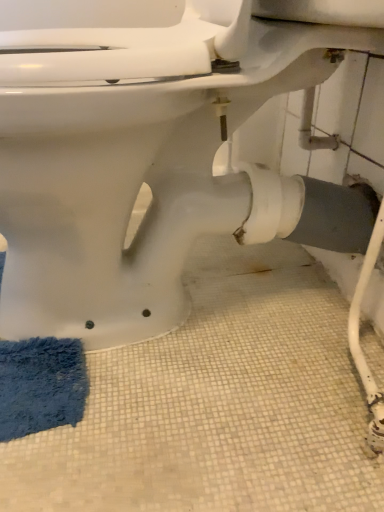
Where is `white glossy toilet at center`? white glossy toilet at center is located at coordinates (145, 155).

This screenshot has height=512, width=384. Describe the element at coordinates (145, 155) in the screenshot. I see `white glossy toilet at center` at that location.

What do you see at coordinates (41, 385) in the screenshot? I see `blue fuzzy bath mat at lower left` at bounding box center [41, 385].

You are a GUI agent. You are given a task and a screenshot of the screen. Output one action in this format:
    pyautogui.click(x=<x>, y=<y>)
    Task: Click on the blue fuzzy bath mat at lower left
    The width and height of the screenshot is (384, 512).
    Given the screenshot: What is the action you would take?
    click(x=41, y=385)

Where is `white glossy toilet at center`? This screenshot has height=512, width=384. white glossy toilet at center is located at coordinates (145, 155).

Visually, is white glossy toilet at center positioned to the left or to the right of blue fuzzy bath mat at lower left?

Clearly, white glossy toilet at center is on the right of blue fuzzy bath mat at lower left in the image.

In the image, is white glossy toilet at center positioned in front of or behind blue fuzzy bath mat at lower left?

Visually, white glossy toilet at center is located in front of blue fuzzy bath mat at lower left.

In the scene shown: Which is closer, (79, 298) or (68, 370)?

Point (79, 298) is farther from the camera than point (68, 370).

From the image's perspective, who appears lower, white glossy toilet at center or blue fuzzy bath mat at lower left?

blue fuzzy bath mat at lower left appears lower in the image.

In the scene shown: From a real-world perspective, is white glossy toilet at center below blue fuzzy bath mat at lower left?

No, from a real-world perspective, white glossy toilet at center is not below blue fuzzy bath mat at lower left.

Considering the sizes of objects white glossy toilet at center and blue fuzzy bath mat at lower left in the image provided, who is thinner, white glossy toilet at center or blue fuzzy bath mat at lower left?

blue fuzzy bath mat at lower left.

Between white glossy toilet at center and blue fuzzy bath mat at lower left, which one has more height?

Standing taller between the two is white glossy toilet at center.

Considering the sizes of objects white glossy toilet at center and blue fuzzy bath mat at lower left in the image provided, who is smaller, white glossy toilet at center or blue fuzzy bath mat at lower left?

With smaller size is blue fuzzy bath mat at lower left.

Is white glossy toilet at center inside the boundaries of blue fuzzy bath mat at lower left, or outside?

white glossy toilet at center is not enclosed by blue fuzzy bath mat at lower left.

Are white glossy toilet at center and blue fuzzy bath mat at lower left located far from each other?

white glossy toilet at center is near blue fuzzy bath mat at lower left, not far away.

Is white glossy toilet at center oriented towards blue fuzzy bath mat at lower left?

No, white glossy toilet at center does not turn towards blue fuzzy bath mat at lower left.

This screenshot has height=512, width=384. What are the coordinates of `bath mat on the left of the white glossy toilet at center` in the screenshot? It's located at (41, 385).

In the scene shown: In the image, is blue fuzzy bath mat at lower left on the left side or the right side of white glossy toilet at center?

Clearly, blue fuzzy bath mat at lower left is on the left of white glossy toilet at center in the image.

In the scene shown: Relative to white glossy toilet at center, is blue fuzzy bath mat at lower left in front or behind?

In the image, blue fuzzy bath mat at lower left appears behind white glossy toilet at center.

Is point (5, 386) positioned after point (228, 221)?

No, (5, 386) is in front of (228, 221).

Based on the photo, from the image's perspective, is blue fuzzy bath mat at lower left over white glossy toilet at center?

No, from the image's perspective, blue fuzzy bath mat at lower left is not over white glossy toilet at center.

From a real-world perspective, between blue fuzzy bath mat at lower left and white glossy toilet at center, who is vertically lower?

From a 3D spatial view, blue fuzzy bath mat at lower left is below.

Based on the photo, does blue fuzzy bath mat at lower left have a lesser width compared to white glossy toilet at center?

Indeed, blue fuzzy bath mat at lower left has a lesser width compared to white glossy toilet at center.

Considering the relative sizes of blue fuzzy bath mat at lower left and white glossy toilet at center in the image provided, is blue fuzzy bath mat at lower left shorter than white glossy toilet at center?

Correct, blue fuzzy bath mat at lower left is not as tall as white glossy toilet at center.

Considering the sizes of objects blue fuzzy bath mat at lower left and white glossy toilet at center in the image provided, who is bigger, blue fuzzy bath mat at lower left or white glossy toilet at center?

Bigger between the two is white glossy toilet at center.

Is white glossy toilet at center surrounded by blue fuzzy bath mat at lower left?

No, white glossy toilet at center is not a part of blue fuzzy bath mat at lower left.

Is there a large distance between blue fuzzy bath mat at lower left and white glossy toilet at center?

No, there isn't a large distance between blue fuzzy bath mat at lower left and white glossy toilet at center.

Consider the image. Is blue fuzzy bath mat at lower left facing away from white glossy toilet at center?

blue fuzzy bath mat at lower left is not turned away from white glossy toilet at center.

Where is `bath mat below the white glossy toilet at center (from the image's perspective)`? Image resolution: width=384 pixels, height=512 pixels. bath mat below the white glossy toilet at center (from the image's perspective) is located at coordinates [41, 385].

This screenshot has height=512, width=384. Identify the location of toilet above the blue fuzzy bath mat at lower left (from the image's perspective). (145, 155).

Where is `toilet located in front of the blue fuzzy bath mat at lower left`? toilet located in front of the blue fuzzy bath mat at lower left is located at coordinates (145, 155).